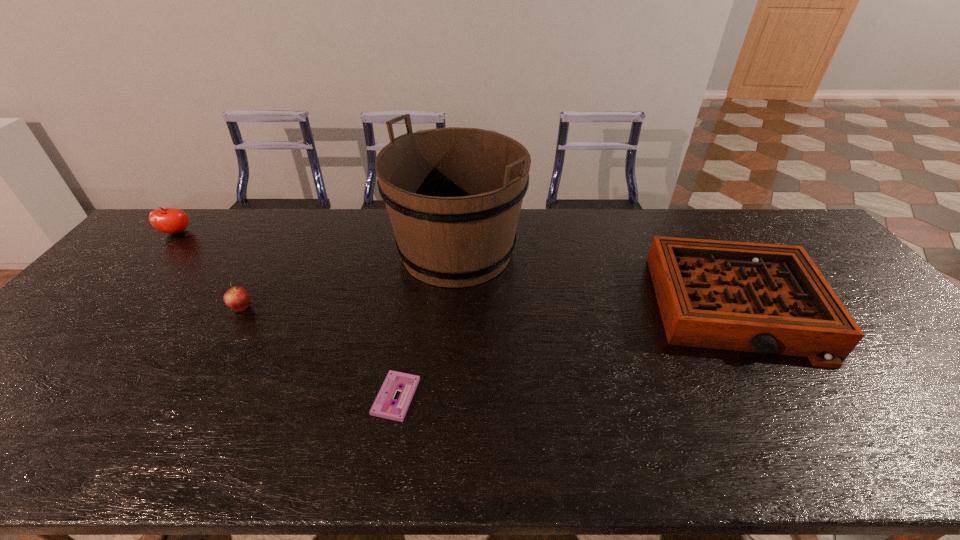
Where is `bucket`? This screenshot has width=960, height=540. bucket is located at coordinates (453, 195).

Find the location of a particular element. the farther apple is located at coordinates (167, 220).

At what (x,y) coordinates should I click in order to perform the action: click on the leftmost object. Please return your answer as a coordinate pair (x, y). Looking at the image, I should click on (167, 220).

Identify the location of the nearer apple. This screenshot has height=540, width=960. (237, 298).

This screenshot has width=960, height=540. In order to click on the second object from left to right in this screenshot , I will do `click(237, 298)`.

Identify the location of the rightmost object. (767, 298).

The width and height of the screenshot is (960, 540). I want to click on the nearest object, so click(x=383, y=406).

Image resolution: width=960 pixels, height=540 pixels. Find the location of `videotape`. videotape is located at coordinates (383, 406).

This screenshot has width=960, height=540. I want to click on free location located on the left of the bucket, so click(x=290, y=252).

Image resolution: width=960 pixels, height=540 pixels. What are the coordinates of `vacant space situated on the right of the farther apple` in the screenshot? It's located at (299, 232).